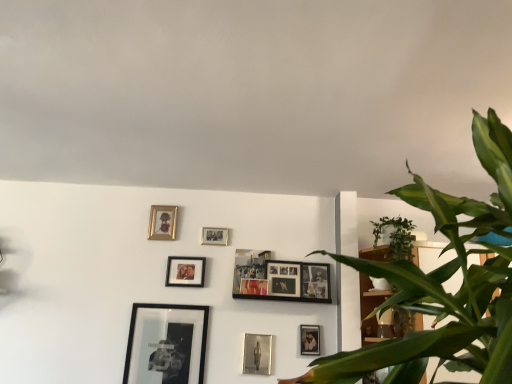
Describe the element at coordinates (253, 286) in the screenshot. I see `matte black picture frame at center, arranged as the 6th picture frame when viewed from the left` at that location.

Image resolution: width=512 pixels, height=384 pixels. Find the location of `wooden bookshelf at right`. wooden bookshelf at right is located at coordinates (366, 308).

The image size is (512, 384). What do you see at coordinates (442, 282) in the screenshot? I see `green leafy plant at right` at bounding box center [442, 282].

You are a GUI agent. You are given a task and a screenshot of the screen. Output one action in this format:
    pyautogui.click(x=<x>, y=<y>)
    Task: Click on the metallic silver photo frame at upper center, marked as the fourth picture frame in a left-to-right arrangement
    Image resolution: width=512 pixels, height=384 pixels.
    Given the screenshot: What is the action you would take?
    pyautogui.click(x=214, y=236)

Describe the element at coordinates (214, 236) in the screenshot. I see `metallic silver photo frame at upper center, marked as the fourth picture frame in a left-to-right arrangement` at that location.

In order to click on matte black picture frame at center, arranged as the 6th picture frame when viewed from the left in this screenshot , I will do `click(253, 286)`.

Find the location of a particular element. The width and height of the screenshot is (512, 384). picture frame that is the 3rd one when counting forward from the wooden photo frame at center, the 3th picture frame positioned from the right is located at coordinates (257, 354).

From a real-world perspective, which object rests below the other?

metallic silver photo frame at lower center, the seventh picture frame in the left-to-right sequence.

Which of these two, wooden photo frame at center, the 3th picture frame positioned from the right, or metallic silver photo frame at lower center, the seventh picture frame in the left-to-right sequence, is thinner?

metallic silver photo frame at lower center, the seventh picture frame in the left-to-right sequence, is thinner.

Does wooden photo frame at center, the eighth picture frame when ordered from left to right, have a larger size compared to metallic silver photo frame at lower center, the seventh picture frame in the left-to-right sequence?

Yes.

From a real-world perspective, is matte black picture frame at center, which is the 6th picture frame from right to left, on matte black picture frame at lower center, marked as the 2th picture frame in a right-to-left arrangement?

Indeed, from a real-world perspective, matte black picture frame at center, which is the 6th picture frame from right to left, stands above matte black picture frame at lower center, marked as the 2th picture frame in a right-to-left arrangement.

Does matte black picture frame at center, which is the 6th picture frame from right to left, have a greater width compared to matte black picture frame at lower center, the ninth picture frame from the left?

No.

Is matte black picture frame at center, which is the 5th picture frame from left to right, directly adjacent to matte black picture frame at lower center, the ninth picture frame from the left?

matte black picture frame at center, which is the 5th picture frame from left to right, and matte black picture frame at lower center, the ninth picture frame from the left, are not in contact.

Between matte black picture frame at center, which is the 5th picture frame from left to right, and matte black picture frame at lower center, the ninth picture frame from the left, which one appears on the right side from the viewer's perspective?

From the viewer's perspective, matte black picture frame at lower center, the ninth picture frame from the left, appears more on the right side.

Would you say matte black picture frame at lower center, the ninth picture frame from the left, is inside or outside wooden photo frame at center, placed as the first picture frame when sorted from right to left?

matte black picture frame at lower center, the ninth picture frame from the left, is outside wooden photo frame at center, placed as the first picture frame when sorted from right to left.

Is matte black picture frame at lower center, the ninth picture frame from the left, to the left or to the right of wooden photo frame at center, placed as the first picture frame when sorted from right to left, in the image?

Based on their positions, matte black picture frame at lower center, the ninth picture frame from the left, is located to the left of wooden photo frame at center, placed as the first picture frame when sorted from right to left.

Which is behind, matte black picture frame at lower center, marked as the 2th picture frame in a right-to-left arrangement, or wooden photo frame at center, acting as the tenth picture frame starting from the left?

wooden photo frame at center, acting as the tenth picture frame starting from the left, is more distant.

Can you confirm if matte black picture frame at lower center, the ninth picture frame from the left, is taller than wooden photo frame at center, acting as the tenth picture frame starting from the left?

In fact, matte black picture frame at lower center, the ninth picture frame from the left, may be shorter than wooden photo frame at center, acting as the tenth picture frame starting from the left.

Who is more distant, matte black picture frame at center, which is the fifth picture frame in right-to-left order, or wooden photo frame at center, the 3th picture frame positioned from the right?

wooden photo frame at center, the 3th picture frame positioned from the right, is more distant.

Does matte black picture frame at center, arranged as the 6th picture frame when viewed from the left, appear on the left side of wooden photo frame at center, the 3th picture frame positioned from the right?

Indeed, matte black picture frame at center, arranged as the 6th picture frame when viewed from the left, is positioned on the left side of wooden photo frame at center, the 3th picture frame positioned from the right.

Which of these two, matte black picture frame at center, arranged as the 6th picture frame when viewed from the left, or wooden photo frame at center, the 3th picture frame positioned from the right, is smaller?

Smaller between the two is matte black picture frame at center, arranged as the 6th picture frame when viewed from the left.

Are matte black picture frame at center, which is the 6th picture frame from right to left, and wooden photo frame at center, acting as the tenth picture frame starting from the left, making contact?

matte black picture frame at center, which is the 6th picture frame from right to left, is not next to wooden photo frame at center, acting as the tenth picture frame starting from the left, and they're not touching.

From the image's perspective, who appears lower, matte black picture frame at center, which is the 5th picture frame from left to right, or wooden photo frame at center, placed as the first picture frame when sorted from right to left?

wooden photo frame at center, placed as the first picture frame when sorted from right to left, appears lower in the image.

Where is `the 1st picture frame in front of the matte black picture frame at center, which is the 6th picture frame from right to left, counting from the anchor's position`? the 1st picture frame in front of the matte black picture frame at center, which is the 6th picture frame from right to left, counting from the anchor's position is located at coordinates (316, 281).

How many degrees apart are the facing directions of matte black picture frame at center, which is the 6th picture frame from right to left, and wooden photo frame at center, acting as the tenth picture frame starting from the left?

There is a 0.00132-degree angle between the facing directions of matte black picture frame at center, which is the 6th picture frame from right to left, and wooden photo frame at center, acting as the tenth picture frame starting from the left.

Between wooden photo frame at center, acting as the tenth picture frame starting from the left, and matte black picture frame at center, which is the 6th picture frame from right to left, which one has larger width?

wooden photo frame at center, acting as the tenth picture frame starting from the left.

Considering the relative sizes of wooden photo frame at center, acting as the tenth picture frame starting from the left, and matte black picture frame at center, which is the 5th picture frame from left to right, in the image provided, is wooden photo frame at center, acting as the tenth picture frame starting from the left, taller than matte black picture frame at center, which is the 5th picture frame from left to right,?

No, wooden photo frame at center, acting as the tenth picture frame starting from the left, is not taller than matte black picture frame at center, which is the 5th picture frame from left to right.

Would you consider wooden photo frame at center, acting as the tenth picture frame starting from the left, to be distant from matte black picture frame at center, which is the 5th picture frame from left to right?

No.

Is point (326, 280) closer or farther from the camera than point (255, 293)?

Point (326, 280).

Based on their sizes in the image, would you say wooden photo frame at center, acting as the tenth picture frame starting from the left, is bigger or smaller than wooden bookshelf at right?

Clearly, wooden photo frame at center, acting as the tenth picture frame starting from the left, is smaller in size than wooden bookshelf at right.

Can you confirm if wooden photo frame at center, acting as the tenth picture frame starting from the left, is taller than wooden bookshelf at right?

No.

Which is in front, point (324, 272) or point (418, 320)?

The point (418, 320) is closer.

Where is `the 1st picture frame to the left when counting from the wooden photo frame at center, the eighth picture frame when ordered from left to right`? This screenshot has width=512, height=384. the 1st picture frame to the left when counting from the wooden photo frame at center, the eighth picture frame when ordered from left to right is located at coordinates (257, 354).

Where is `the 5th picture frame positioned above the matte black picture frame at lower center, the ninth picture frame from the left (from a real-world perspective)`? the 5th picture frame positioned above the matte black picture frame at lower center, the ninth picture frame from the left (from a real-world perspective) is located at coordinates (250, 272).

Which object lies further to the anchor point green leafy plant at right, metallic silver photo frame at lower center, the seventh picture frame in the left-to-right sequence, or black matte picture frame at lower left, the 9th picture frame when ordered from right to left?

Based on the image, black matte picture frame at lower left, the 9th picture frame when ordered from right to left, appears to be further to green leafy plant at right.

Which object lies nearer to the anchor point black matte picture frame at lower left, arranged as the second picture frame when viewed from the left, metallic silver photo frame at lower center, which is the fourth picture frame from right to left, or wooden photo frame at center, the eighth picture frame when ordered from left to right?

The object closer to black matte picture frame at lower left, arranged as the second picture frame when viewed from the left, is metallic silver photo frame at lower center, which is the fourth picture frame from right to left.

Considering their positions, is metallic silver photo frame at lower center, which is the fourth picture frame from right to left, positioned further to matte black picture frame at center, which is the 5th picture frame from left to right, than wooden photo frame at center, the 3th picture frame positioned from the right?

metallic silver photo frame at lower center, which is the fourth picture frame from right to left, is positioned further to the anchor matte black picture frame at center, which is the 5th picture frame from left to right.

Estimate the real-world distances between objects in this image. Which object is closer to wooden photo frame at center, the 3th picture frame positioned from the right, green leafy plant at right or metallic silver photo frame at upper center, the 7th picture frame from the right?

metallic silver photo frame at upper center, the 7th picture frame from the right, is closer to wooden photo frame at center, the 3th picture frame positioned from the right.

Based on their spatial positions, is green leafy plant at right or matte black picture frame at lower center, marked as the 2th picture frame in a right-to-left arrangement, further from metallic silver photo frame at upper center, the 7th picture frame from the right?

The object further to metallic silver photo frame at upper center, the 7th picture frame from the right, is green leafy plant at right.

When comparing their distances from metallic silver photo frame at upper center, the 7th picture frame from the right, does metallic silver photo frame at lower center, the seventh picture frame in the left-to-right sequence, or wooden photo frame at center, the eighth picture frame when ordered from left to right, seem closer?

wooden photo frame at center, the eighth picture frame when ordered from left to right.

Estimate the real-world distances between objects in this image. Which object is further from black matte picture frame at lower left, the 9th picture frame when ordered from right to left, matte black picture frame at lower center, marked as the 2th picture frame in a right-to-left arrangement, or metallic silver photo frame at upper center, marked as the fourth picture frame in a left-to-right arrangement?

The object further to black matte picture frame at lower left, the 9th picture frame when ordered from right to left, is matte black picture frame at lower center, marked as the 2th picture frame in a right-to-left arrangement.

Looking at the image, which one is located closer to metallic silver photo frame at upper center, marked as the fourth picture frame in a left-to-right arrangement, matte black picture frame at center, the eighth picture frame in the right-to-left sequence, or wooden frame at upper left, the first picture frame in the left-to-right sequence?

matte black picture frame at center, the eighth picture frame in the right-to-left sequence, lies closer to metallic silver photo frame at upper center, marked as the fourth picture frame in a left-to-right arrangement, than the other object.

Where is `bookshelf located between green leafy plant at right and wooden frame at upper left, the first picture frame in the left-to-right sequence, in the depth direction`? This screenshot has width=512, height=384. bookshelf located between green leafy plant at right and wooden frame at upper left, the first picture frame in the left-to-right sequence, in the depth direction is located at coordinates point(366,308).

At what (x,y) coordinates should I click in order to perform the action: click on bookshelf between green leafy plant at right and matte black picture frame at center, which is the 5th picture frame from left to right, along the z-axis. Please return your answer as a coordinate pair (x, y). The height and width of the screenshot is (384, 512). Looking at the image, I should click on (366, 308).

Identify the location of picture frame located between matte black picture frame at lower center, the ninth picture frame from the left, and wooden bookshelf at right in the left-right direction. The height and width of the screenshot is (384, 512). (316, 281).

Where is `bookshelf positioned between green leafy plant at right and matte black picture frame at lower center, marked as the 2th picture frame in a right-to-left arrangement, from near to far`? bookshelf positioned between green leafy plant at right and matte black picture frame at lower center, marked as the 2th picture frame in a right-to-left arrangement, from near to far is located at coordinates (366, 308).